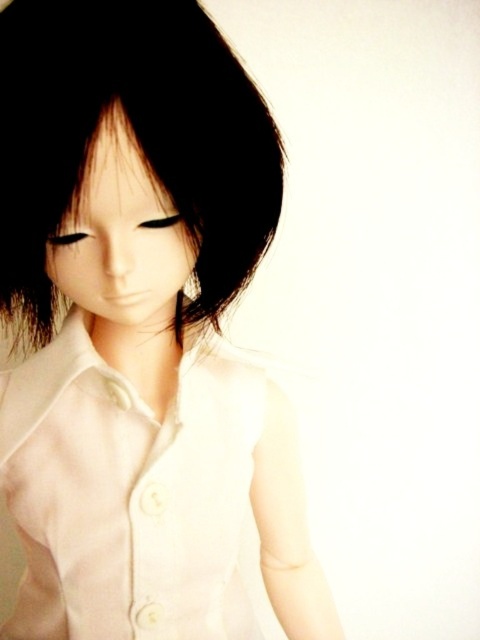
You are an artist trying to sketch the doll. You notice the white matte dress shirt at center and the black matte hair at upper center. Which object should you draw first if you want to start with the larger one?

The black matte hair at upper center should be drawn first because it is larger than the white matte dress shirt at center.

You are a tailor trying to make a new dress shirt for the doll. You have a piece of fabric that is the same width as the black matte hair at upper center. Will this fabric be wide enough to make the white matte dress shirt at center?

The white matte dress shirt at center has a width less than the black matte hair at upper center. Since the fabric is the same width as the hair, it will be wider than needed for the shirt. Therefore, the fabric is sufficient and wide enough for the white matte dress shirt at center.

You are a photographer setting up a shoot. You have a matte white doll at center and black matte hair at upper center in your frame. To ensure proper lighting, you need to know which object is closer to the camera. Based on their positions, which one is closer?

The matte white doll at center is positioned under black matte hair at upper center, meaning the black matte hair at upper center is closer to the camera.